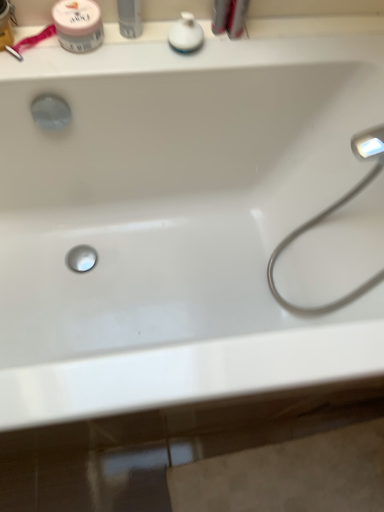
The width and height of the screenshot is (384, 512). In order to click on vacant space to the right of pink matte jar at upper left in this screenshot , I will do `click(144, 53)`.